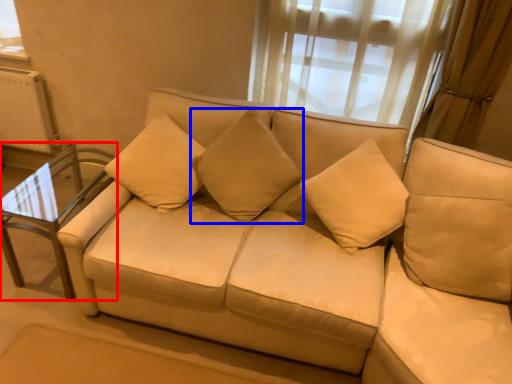
Question: Which object is closer to the camera taking this photo, table (highlighted by a red box) or pillow (highlighted by a blue box)?

Choices:
 (A) table
 (B) pillow

Answer: (B)